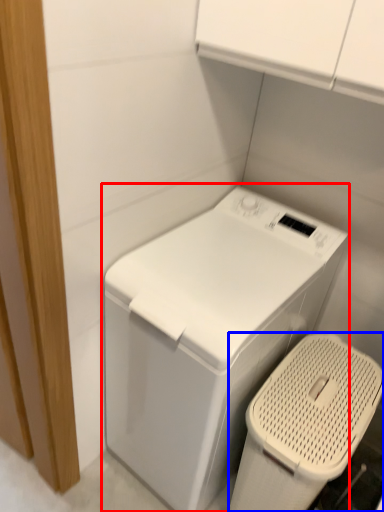
Question: Among these objects, which one is farthest to the camera, washing machine (highlighted by a red box) or appliance (highlighted by a blue box)?

Choices:
 (A) washing machine
 (B) appliance

Answer: (B)